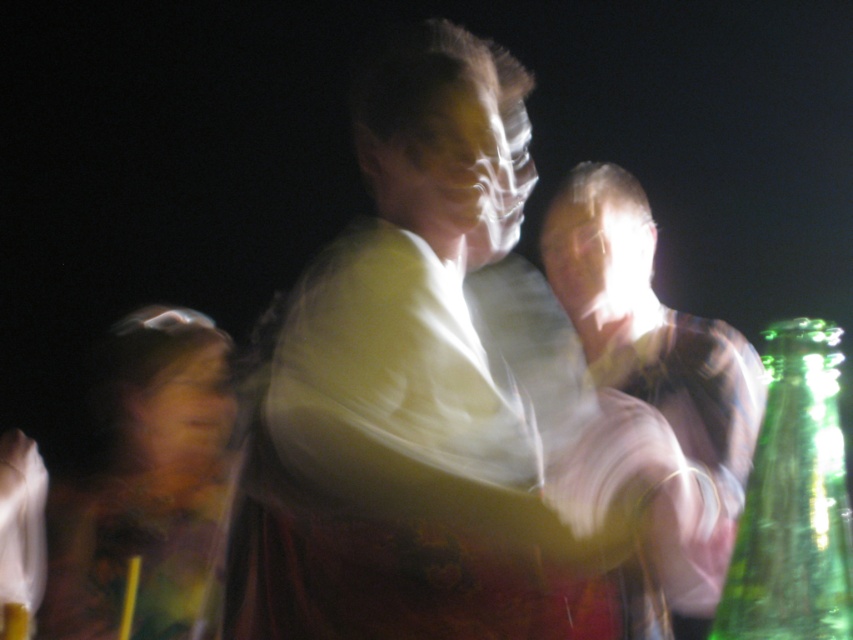
What do you see at coordinates (436, 404) in the screenshot?
I see `white matte shirt at center` at bounding box center [436, 404].

Does white matte shirt at center have a larger size compared to matte white shirt at center?

No.

Who is more distant from viewer, (282, 496) or (650, 321)?

The point (650, 321) is behind.

The width and height of the screenshot is (853, 640). I want to click on white matte shirt at center, so click(x=436, y=404).

Identify the location of matte floral dress at lower left. Image resolution: width=853 pixels, height=640 pixels. (144, 483).

Is matte floral dress at lower left taller than matte white shirt at center?

Incorrect, matte floral dress at lower left's height is not larger of matte white shirt at center's.

Identify the location of matte floral dress at lower left. (144, 483).

I want to click on matte floral dress at lower left, so click(144, 483).

Who is shorter, matte white shirt at center or green glass bottle at right?

green glass bottle at right is shorter.

Locate an element on the screen. matte white shirt at center is located at coordinates (659, 371).

Find the location of a particular element. matte white shirt at center is located at coordinates (659, 371).

Locate an element on the screen. Image resolution: width=853 pixels, height=640 pixels. matte white shirt at center is located at coordinates (659, 371).